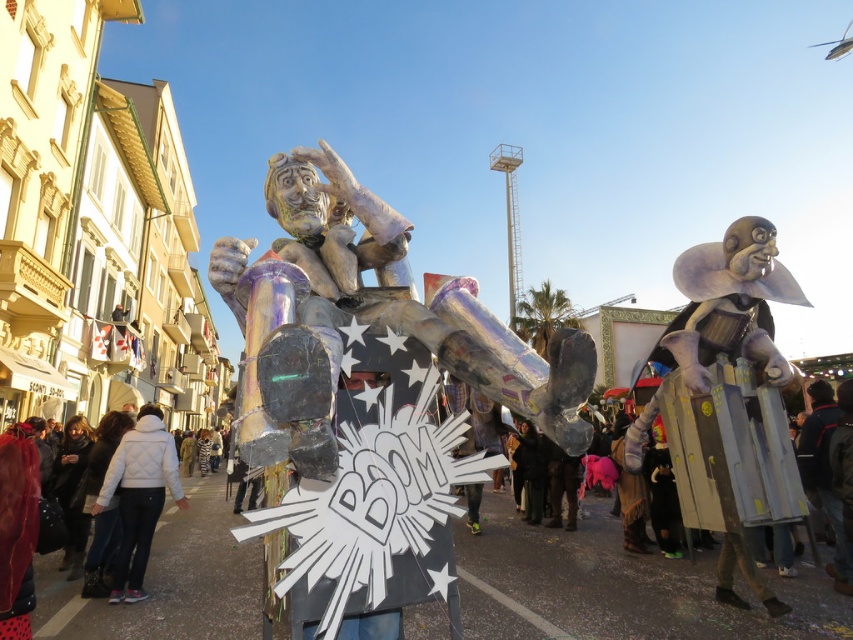
Question: Where is iridescent metallic figure at center located in relation to white quilted jacket at lower left in the image?

Choices:
 (A) below
 (B) above

Answer: (B)

Question: Which point appears closest to the camera in this image?

Choices:
 (A) (254, 465)
 (B) (138, 484)

Answer: (A)

Question: Does iridescent metallic figure at center have a greater width compared to white quilted jacket at lower left?

Choices:
 (A) no
 (B) yes

Answer: (B)

Question: Is iridescent metallic figure at center smaller than white quilted jacket at lower left?

Choices:
 (A) yes
 (B) no

Answer: (A)